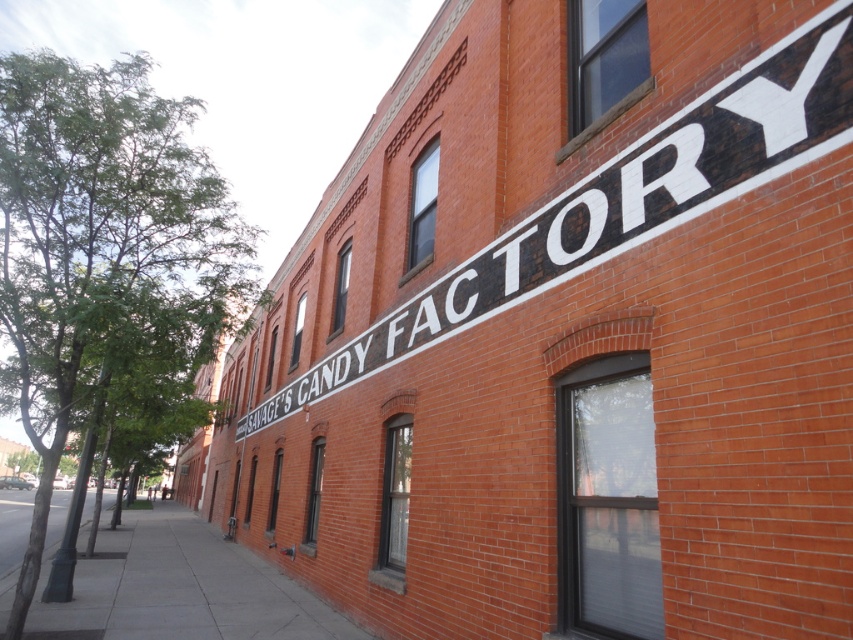
Who is shorter, black painted sign at upper center or gray concrete sidewalk at lower left?

Standing shorter between the two is black painted sign at upper center.

This screenshot has height=640, width=853. I want to click on black painted sign at upper center, so click(x=619, y=202).